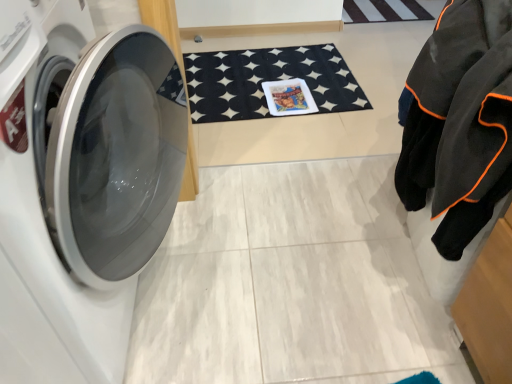
Where is `blank space situated above black felt bath mat at center (from a real-world perspective)`? Image resolution: width=512 pixels, height=384 pixels. blank space situated above black felt bath mat at center (from a real-world perspective) is located at coordinates (263, 77).